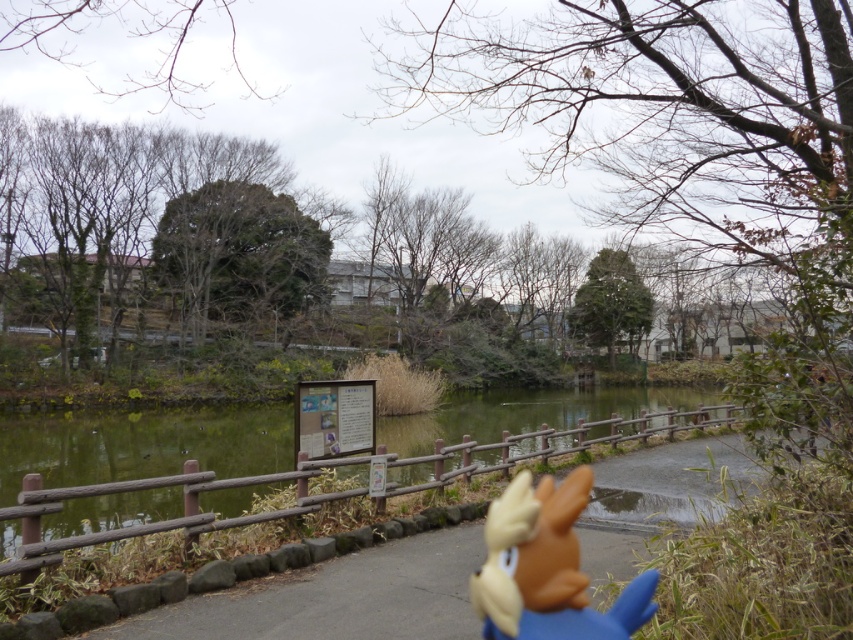
You are a parent trying to ensure your child stays safe while playing in the park. You notice a green wooden fence at center and a brown matte doll at lower center. Which object is taller and could potentially block the child from seeing hazards beyond the fence?

The green wooden fence at center is much taller than the brown matte doll at lower center, so it could potentially block the child from seeing hazards beyond the fence.

You are standing at the entrance of the park and see two points marked in the scene. Which point is closer to you, point (428, 442) or point (483, 573)?

Point (428, 442) is further to the viewer than point (483, 573), so the closer point to you is point (483, 573).

You are a visitor in the park and see the green wooden fence at center and the brown matte doll at lower center. Which object is closer to you?

The brown matte doll at lower center is behind the green wooden fence at center, so the green wooden fence at center is closer to you.